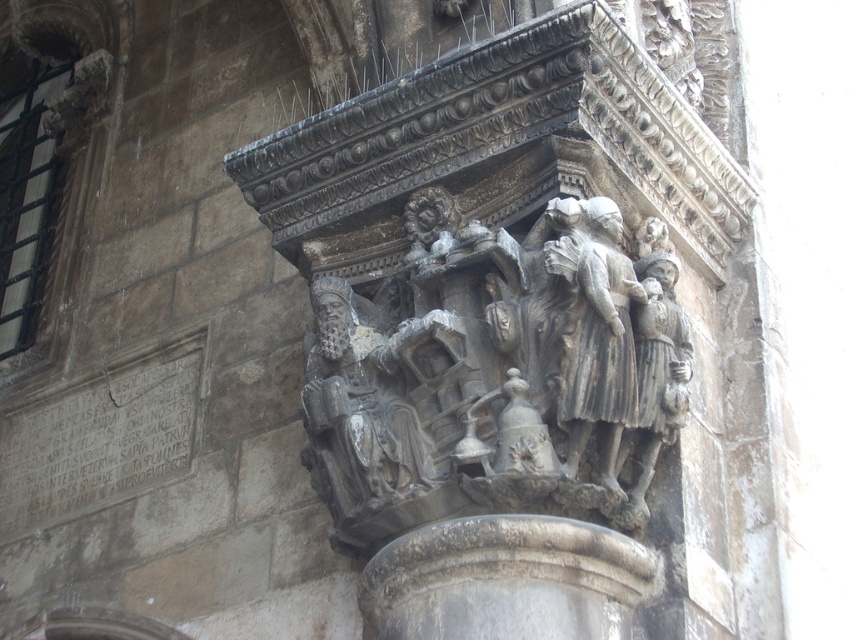
Question: Does gray stone carving at center appear under gray stone figures at center?

Choices:
 (A) yes
 (B) no

Answer: (B)

Question: Which point is closer to the camera?

Choices:
 (A) (688, 346)
 (B) (602, 33)

Answer: (B)

Question: Which point is closer to the camera?

Choices:
 (A) (509, 384)
 (B) (412, 538)

Answer: (B)

Question: Among these objects, which one is farthest from the camera?

Choices:
 (A) gray stone carving at center
 (B) gray stone figures at center

Answer: (B)

Question: Is gray stone carving at center smaller than gray stone figures at center?

Choices:
 (A) no
 (B) yes

Answer: (A)

Question: Is gray stone carving at center positioned at the back of gray stone figures at center?

Choices:
 (A) yes
 (B) no

Answer: (B)